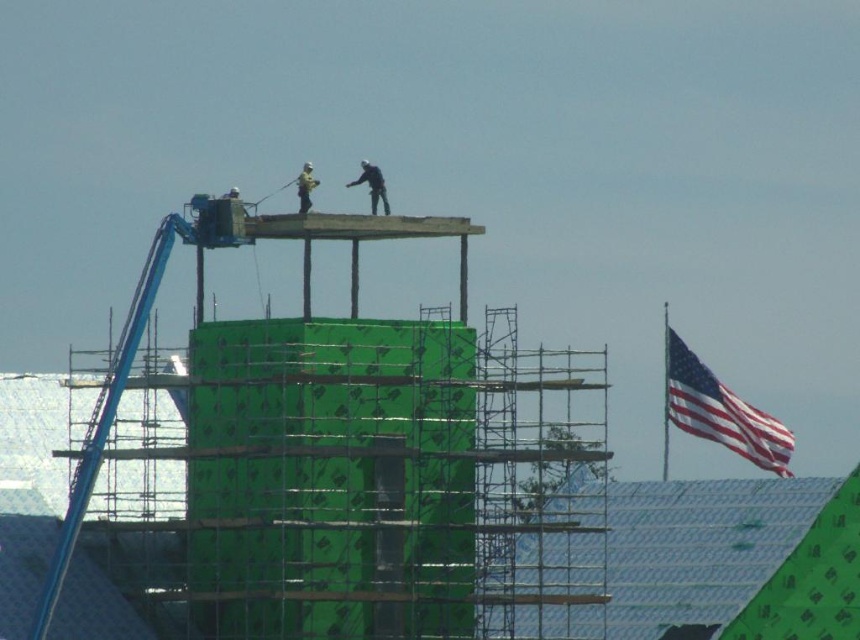
You are a construction supervisor inspecting the site. You need to place a new safety sign that must be exactly 1 meter away from the american flag at right. Where should you place the safety sign relative to the flag?

The safety sign should be placed 1 meter away from the american flag at right in any direction as long as it maintains the required distance. The exact placement depends on the site layout and safety regulations, but the key requirement is the 1 meter distance from the flag.

You are a safety inspector at the construction site. You notice the american flag at right and the light brown wood construction worker at upper center. Which object is wider in the image?

The american flag at right is wider than the light brown wood construction worker at upper center.